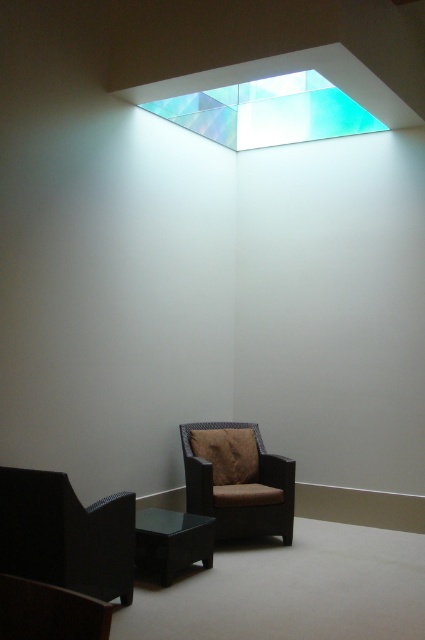
Based on the photo, is matte black armchair at lower left to the right of brown woven armchair at lower center from the viewer's perspective?

Incorrect, matte black armchair at lower left is not on the right side of brown woven armchair at lower center.

Between point (122, 525) and point (207, 477), which one is positioned behind?

Point (207, 477)

Who is more forward, [22,513] or [223,468]?

Point [22,513]

Where is `matte black armchair at lower left`? This screenshot has width=425, height=640. matte black armchair at lower left is located at coordinates (65, 534).

Who is positioned more to the right, matte black armchair at lower left or black glass coffee table at lower center?

black glass coffee table at lower center is more to the right.

Who is lower down, matte black armchair at lower left or black glass coffee table at lower center?

Positioned lower is black glass coffee table at lower center.

Identify the location of matte black armchair at lower left. This screenshot has height=640, width=425. (65, 534).

Can you confirm if brown woven armchair at lower center is smaller than black glass coffee table at lower center?

No, brown woven armchair at lower center is not smaller than black glass coffee table at lower center.

Which is behind, point (254, 506) or point (146, 509)?

The point (146, 509) is behind.

Image resolution: width=425 pixels, height=640 pixels. In order to click on brown woven armchair at lower center in this screenshot , I will do `click(238, 481)`.

What are the coordinates of `brown woven armchair at lower center` in the screenshot? It's located at (238, 481).